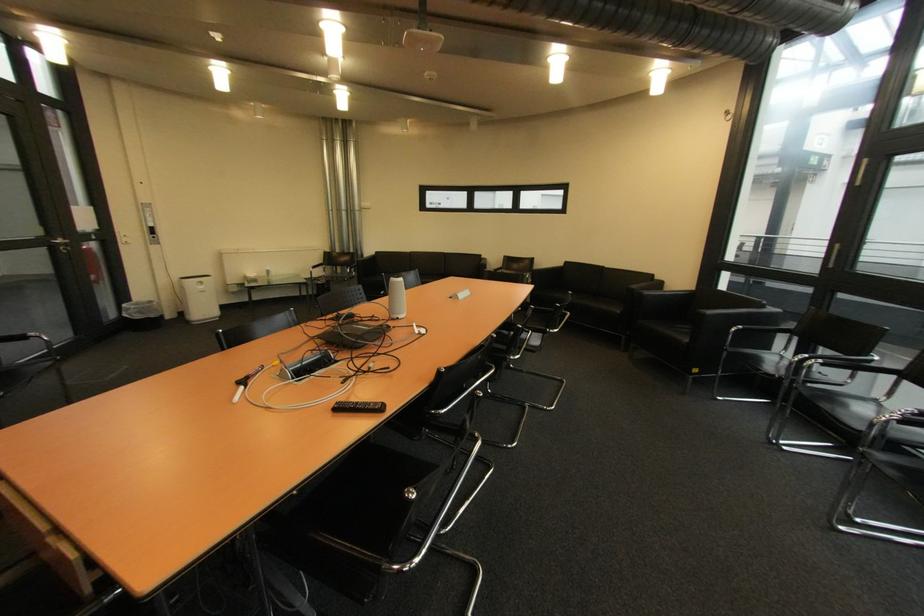
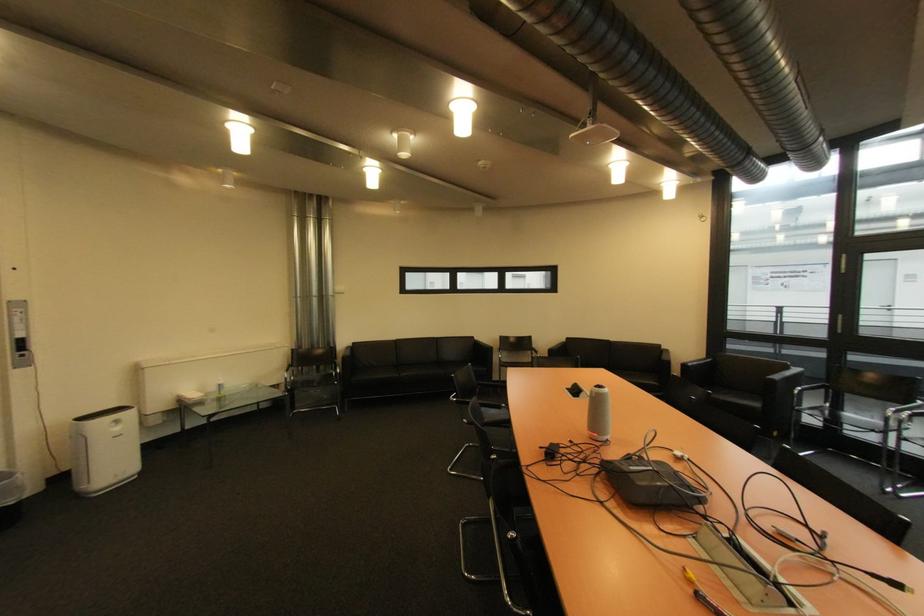
In the second image, find the point that corresponds to [157,304] in the first image.

(10, 477)